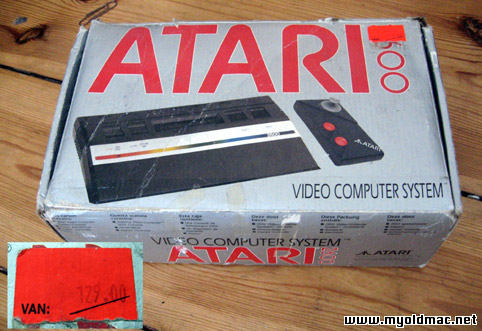
Locate an element on the screen. This screenshot has height=331, width=482. table is located at coordinates (234, 280).